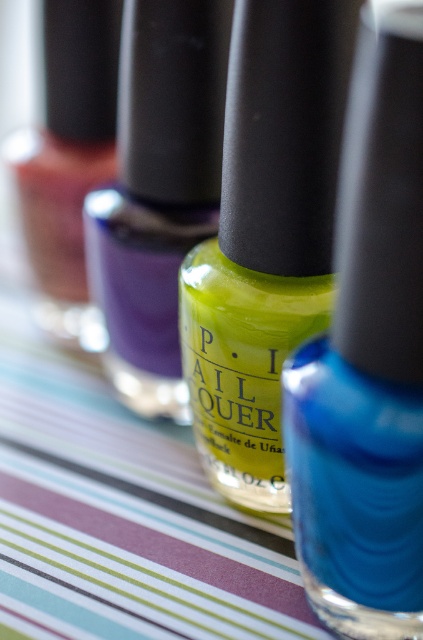
Who is more distant from viewer, [285,248] or [148,99]?

The point [148,99] is more distant.

Can you confirm if lime green glossy nail polish at center is shorter than glossy glass nail polish at center?

Yes, lime green glossy nail polish at center is shorter than glossy glass nail polish at center.

Describe the element at coordinates (266, 236) in the screenshot. This screenshot has height=640, width=423. I see `lime green glossy nail polish at center` at that location.

What are the coordinates of `lime green glossy nail polish at center` in the screenshot? It's located at (266, 236).

Can you confirm if matte yellow nail polish at center is positioned above glossy glass nail polish at center?

No.

Between point (335, 621) and point (126, 323), which one is positioned behind?

The point (126, 323) is behind.

Find the location of a particular element. matte yellow nail polish at center is located at coordinates (368, 360).

Is matte yellow nail polish at center wider than lime green glossy nail polish at center?

Incorrect, matte yellow nail polish at center's width does not surpass lime green glossy nail polish at center's.

Is point (379, 467) positioned in front of point (282, 260)?

Yes, point (379, 467) is closer to viewer.

At what (x,y) coordinates should I click in order to perform the action: click on matte yellow nail polish at center. Please return your answer as a coordinate pair (x, y). Looking at the image, I should click on (368, 360).

Find the location of `matte yellow nail polish at center`. matte yellow nail polish at center is located at coordinates (368, 360).